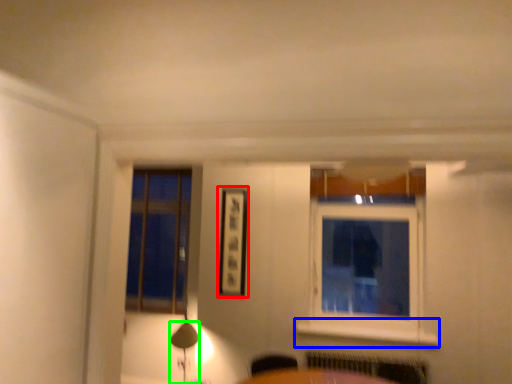
Question: Which object is the farthest from picture frame (highlighted by a red box)? Choose among these: window sill (highlighted by a blue box) or table lamp (highlighted by a green box).

Choices:
 (A) window sill
 (B) table lamp

Answer: (A)